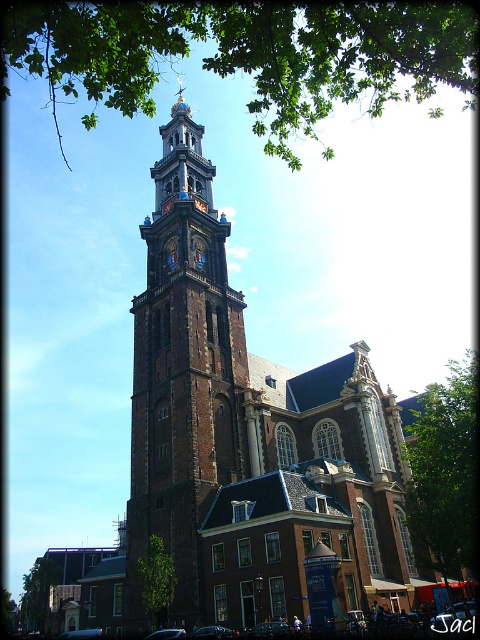
Between brown stone church at center and green leafy tree at upper center, which one is positioned higher?

Positioned higher is green leafy tree at upper center.

Does point (158, 448) come closer to viewer compared to point (121, 81)?

That is False.

Where is `brown stone church at center`? Image resolution: width=480 pixels, height=640 pixels. brown stone church at center is located at coordinates (248, 433).

Between brown stone church at center and brown stone tower at center, which one is positioned lower?

brown stone tower at center is below.

Which of these two, brown stone church at center or brown stone tower at center, stands shorter?

brown stone tower at center

In order to click on brown stone church at center in this screenshot , I will do `click(248, 433)`.

Where is `brown stone church at center`? brown stone church at center is located at coordinates coord(248,433).

Locate an element on the screen. green leafy tree at center is located at coordinates (156, 577).

Is point (162, 541) farther from camera compared to point (45, 582)?

No, (162, 541) is closer to viewer.

The height and width of the screenshot is (640, 480). What do you see at coordinates (156, 577) in the screenshot? I see `green leafy tree at center` at bounding box center [156, 577].

Locate an element on the screen. The height and width of the screenshot is (640, 480). green leafy tree at center is located at coordinates (156, 577).